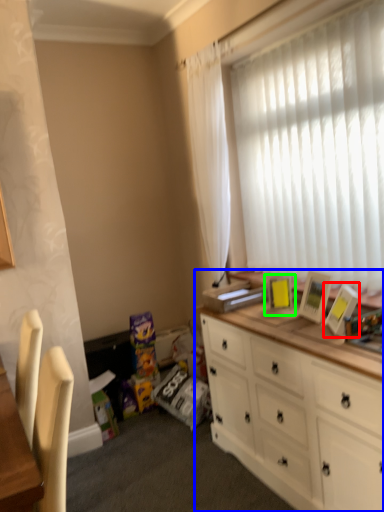
Question: Considering the real-world distances, which object is farthest from picture frame (highlighted by a red box)? cabinetry (highlighted by a blue box) or picture frame (highlighted by a green box)?

Choices:
 (A) cabinetry
 (B) picture frame

Answer: (A)